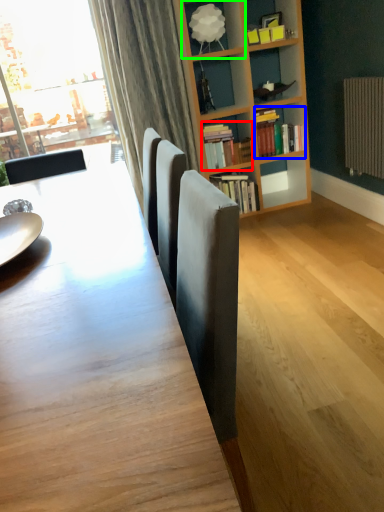
Question: Based on their relative distances, which object is farther from book (highlighted by a red box)? Choose from book (highlighted by a blue box) and shelf (highlighted by a green box).

Choices:
 (A) book
 (B) shelf

Answer: (B)